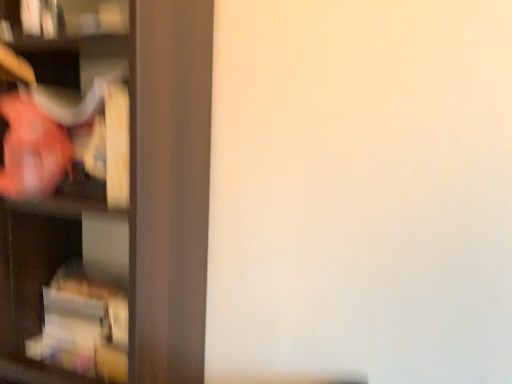
Question: From the image's perspective, is matte brown shelf at left positioned above or below matte plastic cabinet at left?

Choices:
 (A) above
 (B) below

Answer: (A)

Question: Does point (15, 362) appear closer or farther from the camera than point (76, 334)?

Choices:
 (A) closer
 (B) farther

Answer: (A)

Question: Relative to matte plastic cabinet at left, is matte brown shelf at left in front or behind?

Choices:
 (A) front
 (B) behind

Answer: (A)

Question: Is matte plastic cabinet at left in front of or behind matte brown shelf at left in the image?

Choices:
 (A) front
 (B) behind

Answer: (B)

Question: Considering the positions of matte plastic cabinet at left and matte brown shelf at left in the image, is matte plastic cabinet at left wider or thinner than matte brown shelf at left?

Choices:
 (A) wide
 (B) thin

Answer: (B)

Question: Based on their sizes in the image, would you say matte plastic cabinet at left is bigger or smaller than matte brown shelf at left?

Choices:
 (A) small
 (B) big

Answer: (A)

Question: Does point (78, 258) appear closer or farther from the camera than point (15, 264)?

Choices:
 (A) closer
 (B) farther

Answer: (B)